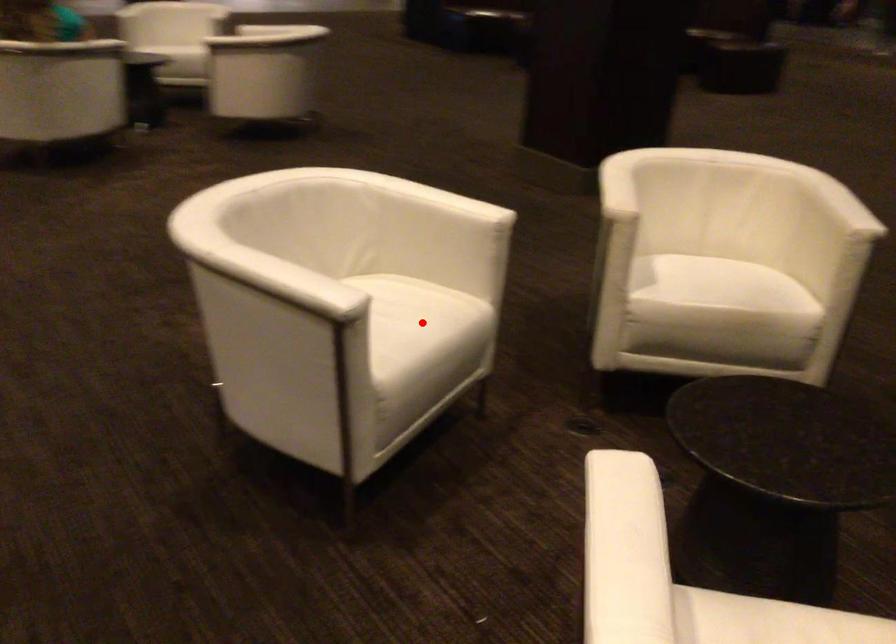
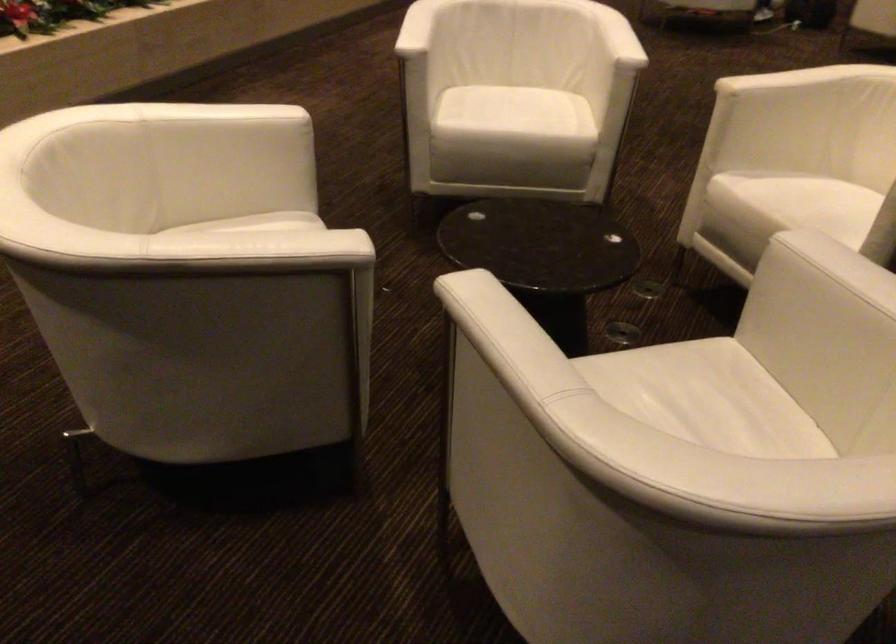
Question: I am providing you with two images of the same scene from different viewpoints. Given a red point in image1, look at the same physical point in image2. Is it:

Choices:
 (A) Closer to the viewpoint
 (B) Farther from the viewpoint

Answer: (B)